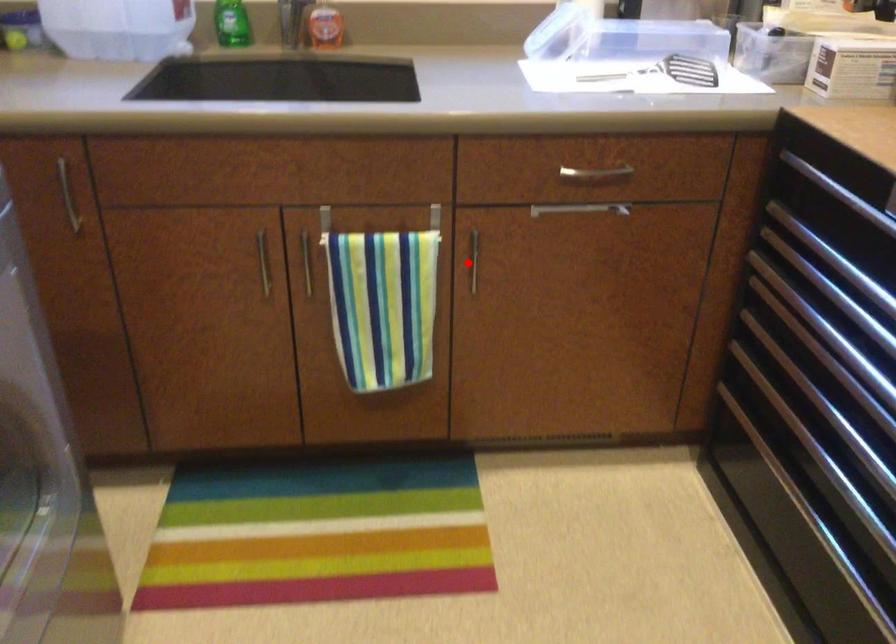
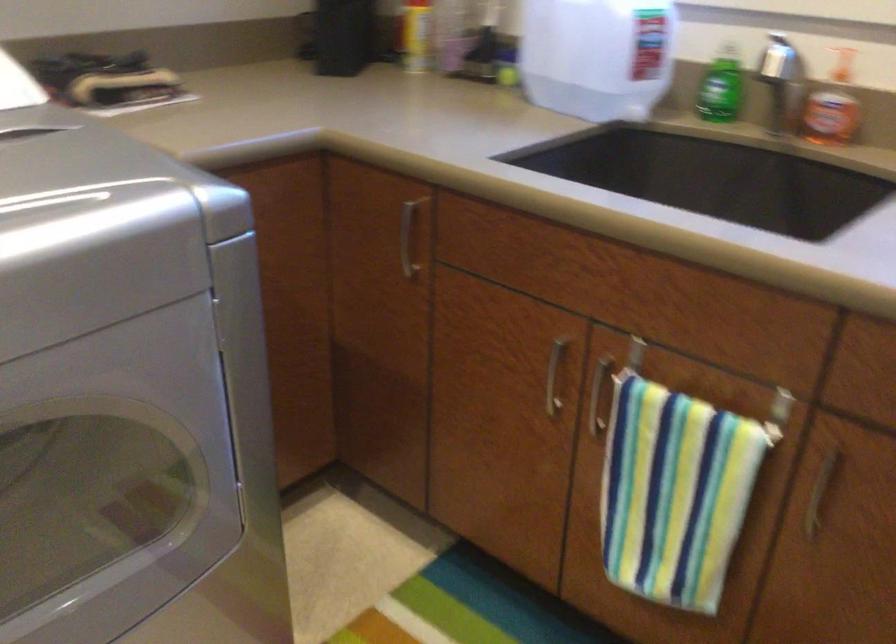
Question: I am providing you with two images of the same scene from different viewpoints. Given a red point in image1, look at the same physical point in image2. Is it:

Choices:
 (A) Closer to the viewpoint
 (B) Farther from the viewpoint

Answer: (A)